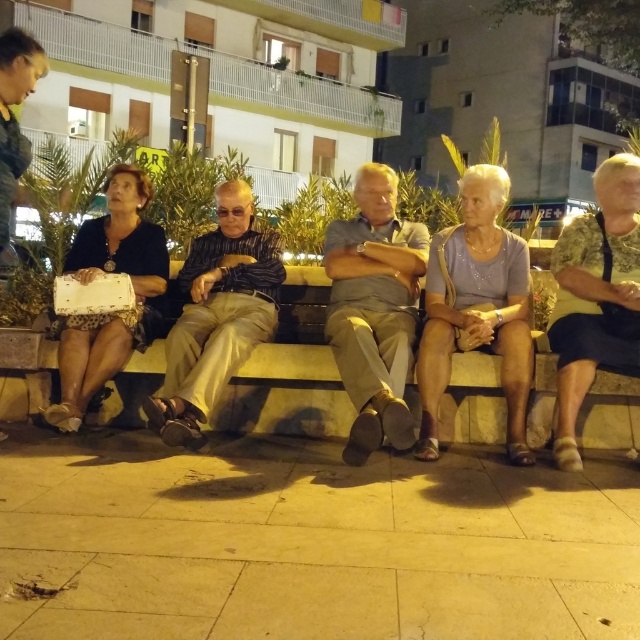
Question: Which of the following is the farthest from the observer?

Choices:
 (A) gray cotton shirt at center
 (B) striped fabric shirt at center

Answer: (B)

Question: Observing the image, what is the correct spatial positioning of matte gray blouse at center in reference to striped fabric shirt at center?

Choices:
 (A) below
 (B) above

Answer: (B)

Question: Is striped fabric shirt at center behind camouflage-patterned shirt at right?

Choices:
 (A) no
 (B) yes

Answer: (A)

Question: Does matte gray blouse at center appear on the left side of camouflage-patterned shirt at right?

Choices:
 (A) no
 (B) yes

Answer: (B)

Question: Which object is positioned farthest from the camouflage-patterned shirt at right?

Choices:
 (A) stone bench at center
 (B) striped fabric shirt at center
 (C) gray cotton shirt at center

Answer: (B)

Question: Which point is closer to the camera taking this photo?

Choices:
 (A) (195, 435)
 (B) (588, 385)
 (C) (97, 365)
 (D) (218, 429)

Answer: (A)